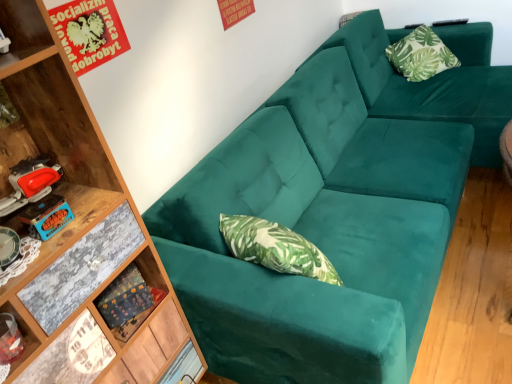
Question: Is green leafy fabric pillow at upper right not near teal velvet couch at upper right?

Choices:
 (A) yes
 (B) no

Answer: (B)

Question: Are green leafy fabric pillow at upper right and teal velvet couch at upper right making contact?

Choices:
 (A) no
 (B) yes

Answer: (A)

Question: From a real-world perspective, is green leafy fabric pillow at upper right beneath teal velvet couch at upper right?

Choices:
 (A) yes
 (B) no

Answer: (B)

Question: From the image's perspective, is green leafy fabric pillow at upper right under teal velvet couch at upper right?

Choices:
 (A) no
 (B) yes

Answer: (A)

Question: Considering the relative sizes of green leafy fabric pillow at upper right and teal velvet couch at upper right in the image provided, is green leafy fabric pillow at upper right smaller than teal velvet couch at upper right?

Choices:
 (A) no
 (B) yes

Answer: (B)

Question: Considering the relative sizes of green leafy fabric pillow at upper right and teal velvet couch at upper right in the image provided, is green leafy fabric pillow at upper right bigger than teal velvet couch at upper right?

Choices:
 (A) no
 (B) yes

Answer: (A)

Question: From a real-world perspective, is teal velvet couch at upper right under green leafy fabric pillow at upper right?

Choices:
 (A) no
 (B) yes

Answer: (B)

Question: Are teal velvet couch at upper right and green leafy fabric pillow at upper right making contact?

Choices:
 (A) yes
 (B) no

Answer: (B)

Question: Is teal velvet couch at upper right positioned in front of green leafy fabric pillow at upper right?

Choices:
 (A) yes
 (B) no

Answer: (A)

Question: From a real-world perspective, is teal velvet couch at upper right located higher than green leafy fabric pillow at upper right?

Choices:
 (A) yes
 (B) no

Answer: (B)

Question: Can you confirm if teal velvet couch at upper right is positioned to the right of green leafy fabric pillow at upper right?

Choices:
 (A) yes
 (B) no

Answer: (B)

Question: From the image's perspective, is teal velvet couch at upper right over green leafy fabric pillow at upper right?

Choices:
 (A) yes
 (B) no

Answer: (B)

Question: Could you tell me if wooden shelf at lower left is turned towards teal velvet couch at upper right?

Choices:
 (A) yes
 (B) no

Answer: (B)